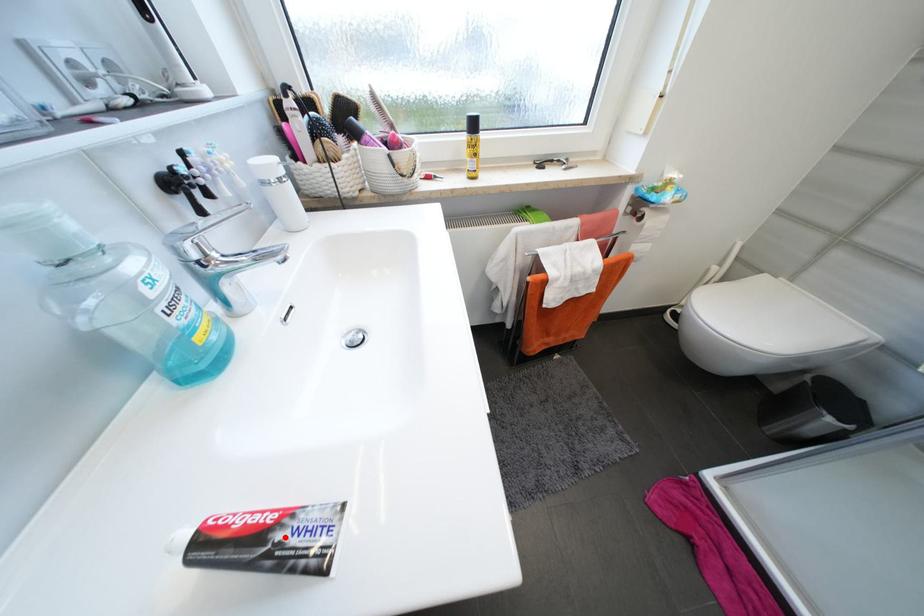
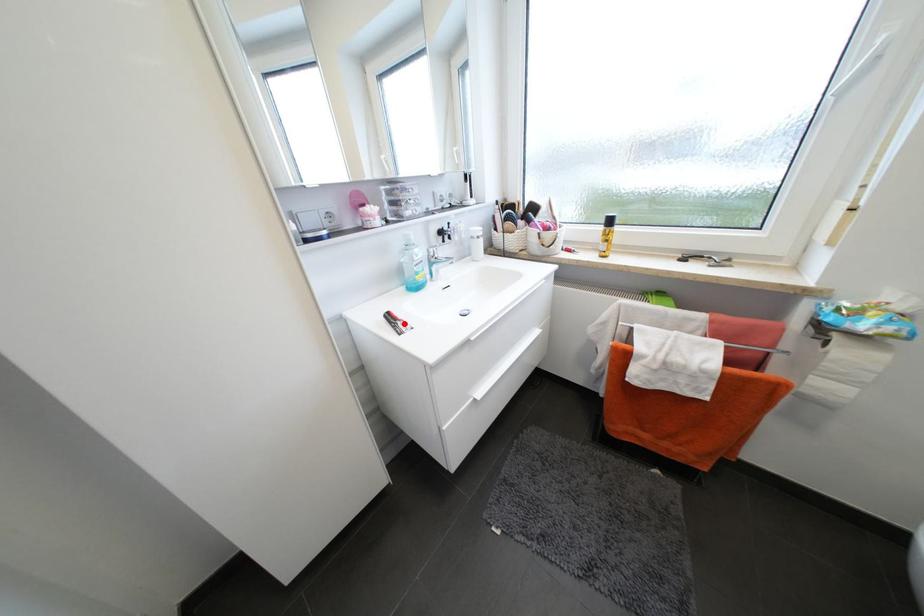
I am providing you with two images of the same scene from different viewpoints. A red point is marked on the first image and another point is marked on the second image. Does the point marked in image1 correspond to the same location as the one in image2?

Yes